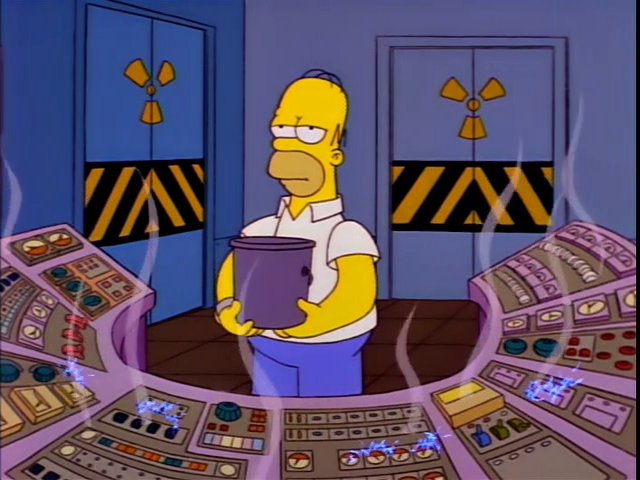
Where is `doors`? Image resolution: width=640 pixels, height=480 pixels. doors is located at coordinates 498,124, 166,131.